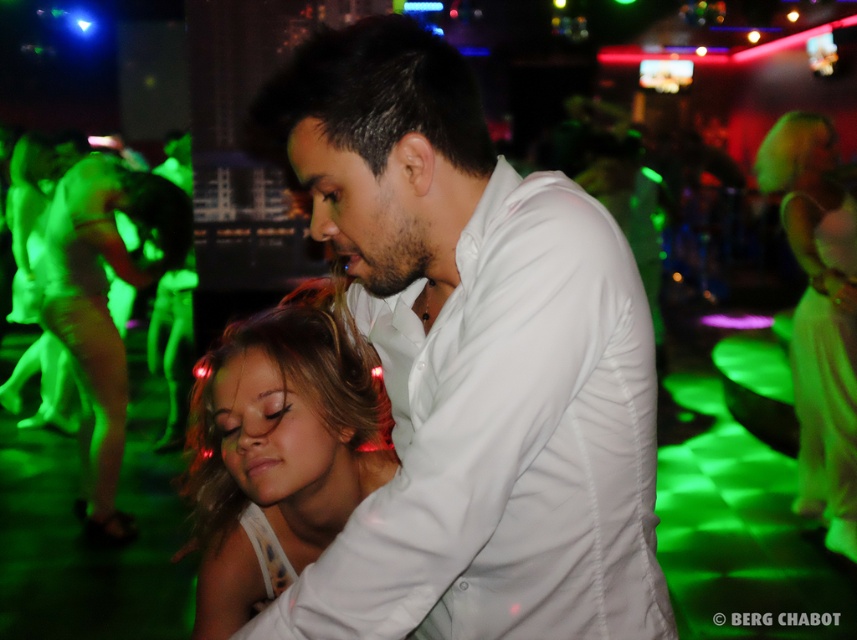
Question: Considering the relative positions of blonde hair at center and silky white dress at center in the image provided, where is blonde hair at center located with respect to silky white dress at center?

Choices:
 (A) left
 (B) right

Answer: (A)

Question: Which of these objects is positioned closest to the silky white dress at center?

Choices:
 (A) white smooth shirt at center
 (B) blonde hair at center

Answer: (B)

Question: Does white smooth shirt at center have a lesser width compared to silky white dress at center?

Choices:
 (A) yes
 (B) no

Answer: (B)

Question: Which point is closer to the camera?

Choices:
 (A) (207, 464)
 (B) (840, 228)
 (C) (136, 195)
 (D) (399, 536)

Answer: (D)

Question: Which object appears closest to the camera in this image?

Choices:
 (A) white smooth shirt at center
 (B) matte green dress at left

Answer: (A)

Question: Is white smooth shirt at center smaller than matte green dress at left?

Choices:
 (A) yes
 (B) no

Answer: (A)